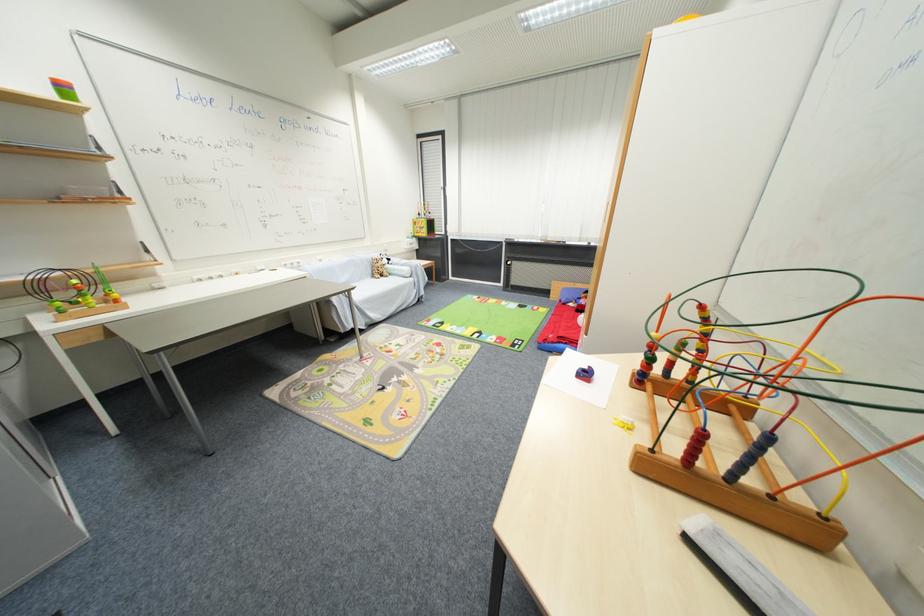
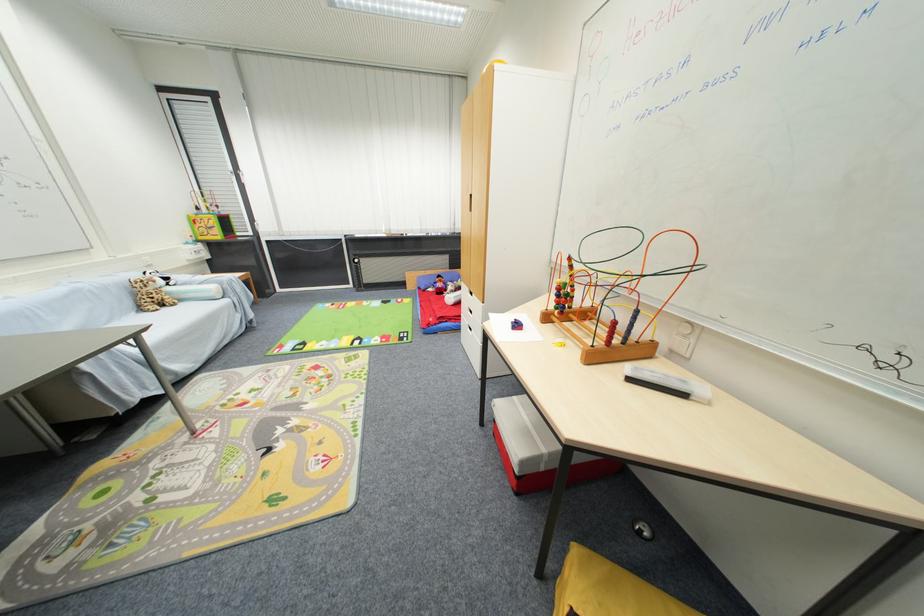
Question: How did the camera likely rotate?

Choices:
 (A) Left
 (B) Right
 (C) Up
 (D) Down

Answer: (B)